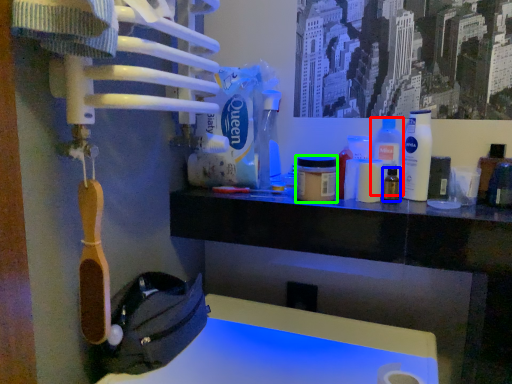
Question: Which object is the farthest from cleaning product (highlighted by a red box)? Choose among these: bottle (highlighted by a blue box) or mouthwash (highlighted by a green box).

Choices:
 (A) bottle
 (B) mouthwash

Answer: (B)